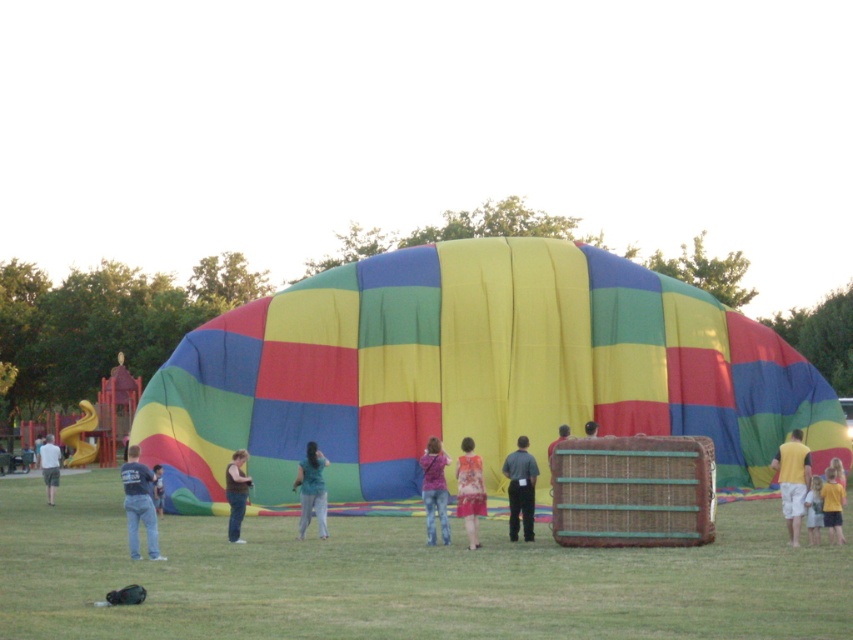
Question: Does yellow t-shirt at lower right appear over matte brown wicker basket at center?

Choices:
 (A) yes
 (B) no

Answer: (B)

Question: Among these objects, which one is farthest from the camera?

Choices:
 (A) matte brown wicker basket at center
 (B) green fabric pants at center
 (C) dark gray shirt at center
 (D) light brown fabric dress at lower right

Answer: (B)

Question: Which object appears closest to the camera in this image?

Choices:
 (A) denim pants at center
 (B) gray cotton shorts at lower left

Answer: (A)

Question: Does pink fabric at center appear under dark brown leather jacket at center?

Choices:
 (A) no
 (B) yes

Answer: (A)

Question: Which of the following is the farthest from the observer?

Choices:
 (A) green fabric pants at center
 (B) light brown fabric dress at lower right
 (C) dark brown leather jacket at center

Answer: (A)

Question: Does denim pants at lower left appear over denim pants at center?

Choices:
 (A) yes
 (B) no

Answer: (A)